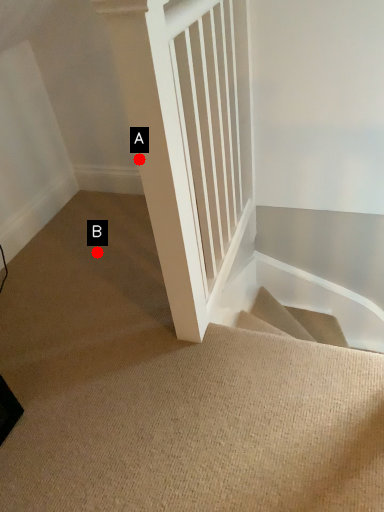
Question: Two points are circled on the image, labeled by A and B beside each circle. Which point appears farthest from the camera in this image?

Choices:
 (A) A is further
 (B) B is further

Answer: (B)